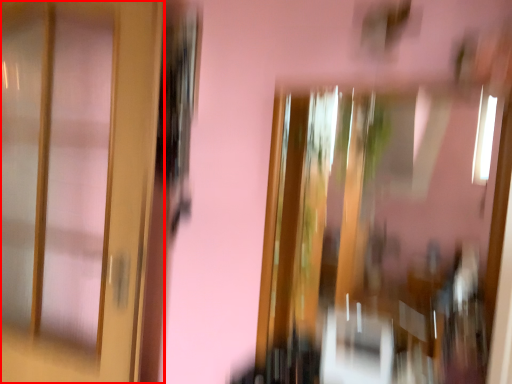
Question: From the image, what is the correct spatial relationship of door (annotated by the red box) in relation to window?

Choices:
 (A) right
 (B) left

Answer: (B)